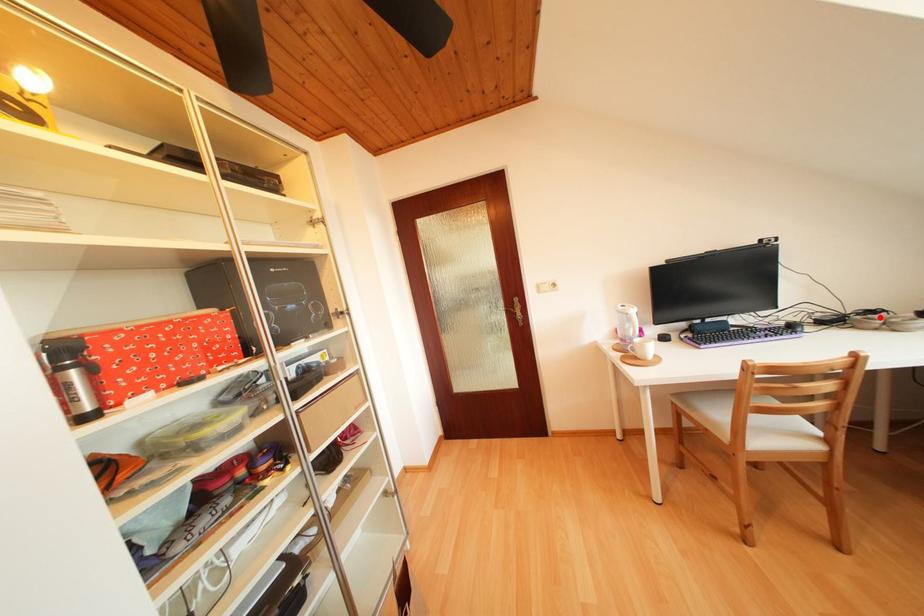
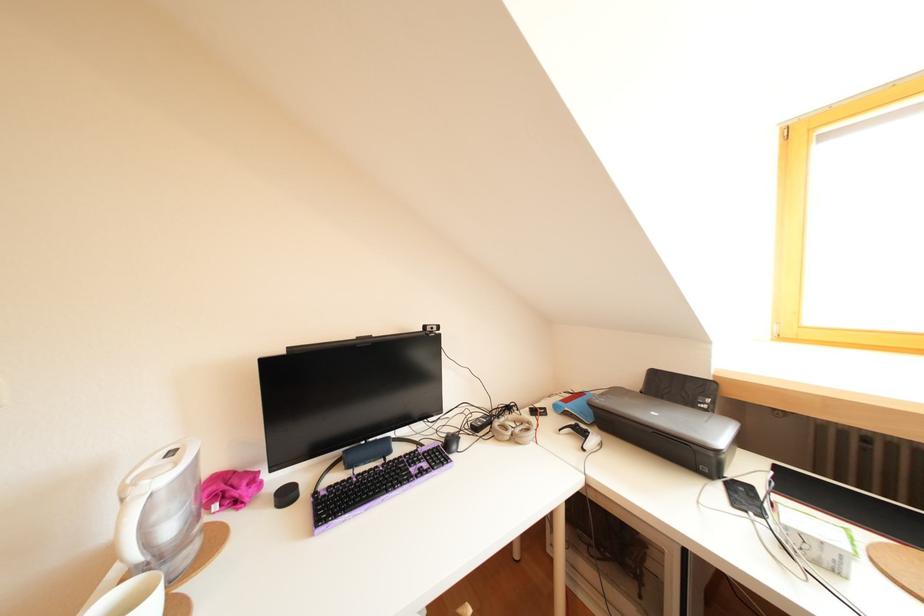
Find the pixel in the second image that matches the highlighted location in the first image.

(516, 413)